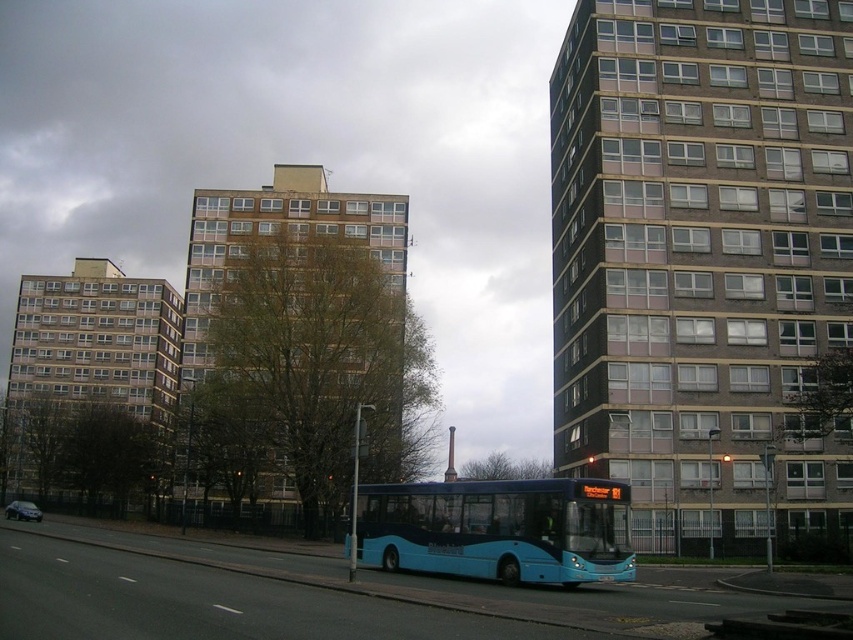
Question: Can you confirm if blue matte bus at center is thinner than metallic silver car at lower left?

Choices:
 (A) yes
 (B) no

Answer: (A)

Question: Where is blue matte bus at center located in relation to metallic silver car at lower left in the image?

Choices:
 (A) above
 (B) below

Answer: (A)

Question: Does blue matte bus at center appear under metallic silver car at lower left?

Choices:
 (A) yes
 (B) no

Answer: (B)

Question: Which point is closer to the camera?

Choices:
 (A) blue matte bus at center
 (B) metallic silver car at lower left

Answer: (A)

Question: Which point appears farthest from the camera in this image?

Choices:
 (A) (486, 496)
 (B) (16, 518)

Answer: (B)

Question: Which point is closer to the camera?

Choices:
 (A) metallic silver car at lower left
 (B) blue matte bus at center

Answer: (B)